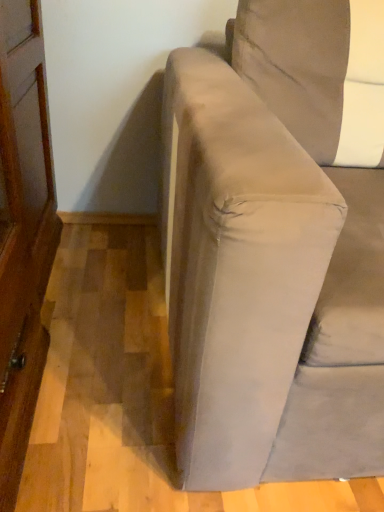
What is the approximate height of suede-like gray couch at center?

32.78 inches.

Describe the element at coordinates (277, 246) in the screenshot. I see `suede-like gray couch at center` at that location.

What are the coordinates of `suede-like gray couch at center` in the screenshot? It's located at (277, 246).

At what (x,y) coordinates should I click in order to perform the action: click on suede-like gray couch at center. Please return your answer as a coordinate pair (x, y). Looking at the image, I should click on (277, 246).